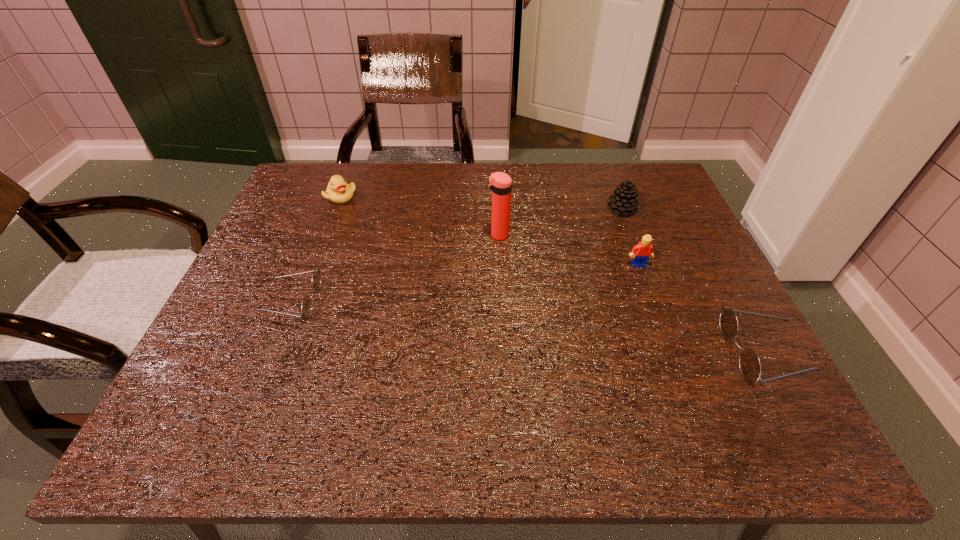
Identify the location of the shortest object. (306, 308).

The image size is (960, 540). What are the coordinates of `the left spectacles` in the screenshot? It's located at (306, 308).

Find the location of a particular element. The height and width of the screenshot is (540, 960). the taller spectacles is located at coordinates (750, 367).

You are a GUI agent. You are given a task and a screenshot of the screen. Output one action in this format:
    pyautogui.click(x=<x>, y=<y>)
    Task: Click on the right spectacles
    This screenshot has width=960, height=540.
    Given the screenshot: What is the action you would take?
    pyautogui.click(x=750, y=367)

This screenshot has height=540, width=960. What are the coordinates of `pinecone` in the screenshot? It's located at (624, 199).

The height and width of the screenshot is (540, 960). In order to click on the fourth object from right to left in this screenshot , I will do `click(500, 183)`.

Identify the location of the tallest object. (500, 183).

Locate an element on the screen. The image size is (960, 540). duckling is located at coordinates (338, 191).

Find the location of a particular element. Image resolution: width=960 pixels, height=540 pixels. the third nearest object is located at coordinates (644, 249).

This screenshot has height=540, width=960. I want to click on vacant space located on the front-facing side of the shortest object, so click(x=230, y=302).